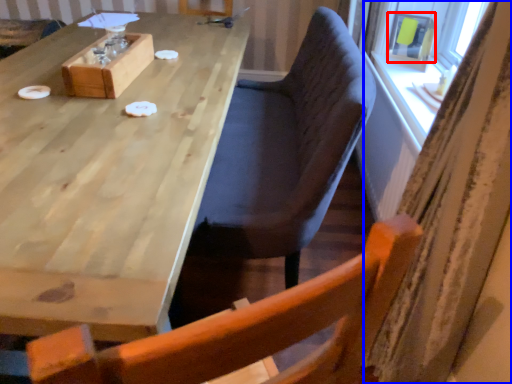
Question: Which of the following is the closest to the observer, window screen (highlighted by a red box) or curtain (highlighted by a blue box)?

Choices:
 (A) window screen
 (B) curtain

Answer: (B)